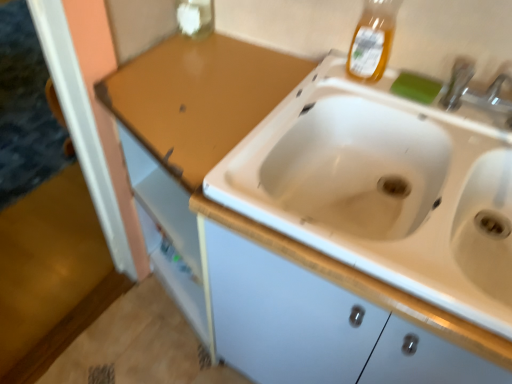
Where is `unoccupied area in front of translucent amber liquid at upper right, which is counted as the second bottle, starting from the left`? Image resolution: width=512 pixels, height=384 pixels. unoccupied area in front of translucent amber liquid at upper right, which is counted as the second bottle, starting from the left is located at coordinates click(x=381, y=96).